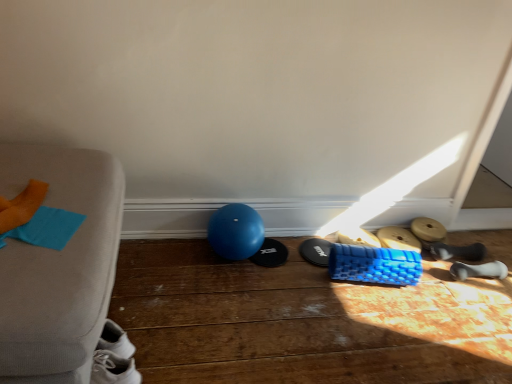
Where is `free area in between blue rubber ball at center and blue textured foam roller at center, which ranks as the 2th footwear in left-to-right order`? Image resolution: width=512 pixels, height=384 pixels. free area in between blue rubber ball at center and blue textured foam roller at center, which ranks as the 2th footwear in left-to-right order is located at coordinates (285, 259).